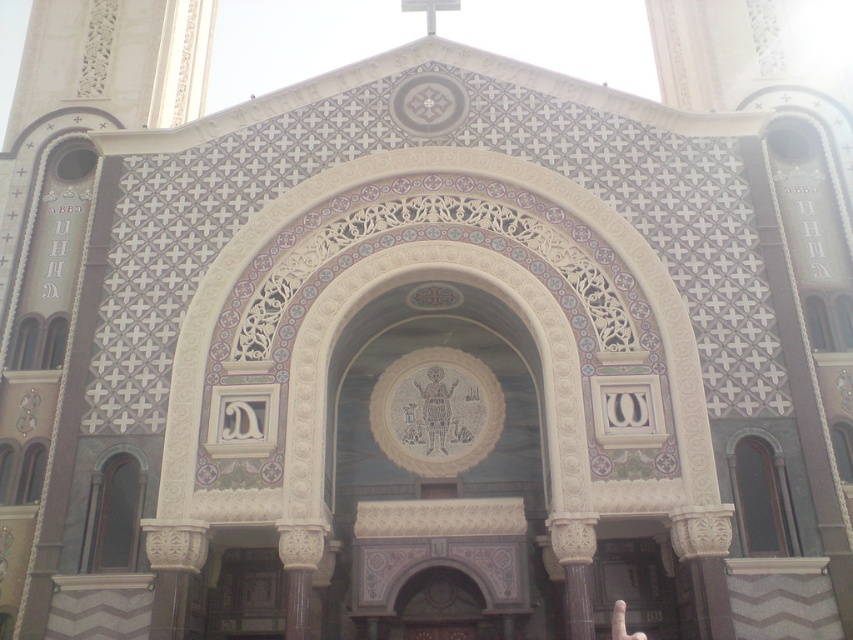
Which of these two, white glossy cross at upper center or white matte finger at lower right, stands taller?

white glossy cross at upper center

Locate an element on the screen. This screenshot has height=640, width=853. white glossy cross at upper center is located at coordinates (428, 10).

Describe the element at coordinates (115, 515) in the screenshot. I see `transparent glass door at left` at that location.

Between transparent glass door at left and white matte finger at lower right, which one appears on the left side from the viewer's perspective?

From the viewer's perspective, transparent glass door at left appears more on the left side.

Measure the distance between point (134, 515) and camera.

The distance of point (134, 515) from camera is 48.12 meters.

Find the location of `transparent glass door at left`. transparent glass door at left is located at coordinates (115, 515).

Who is more distant from viewer, (114,520) or (434,22)?

The point (434,22) is behind.

Does transparent glass door at left have a lesser width compared to white glossy cross at upper center?

Yes, transparent glass door at left is thinner than white glossy cross at upper center.

Find the location of `transparent glass door at left`. transparent glass door at left is located at coordinates (115, 515).